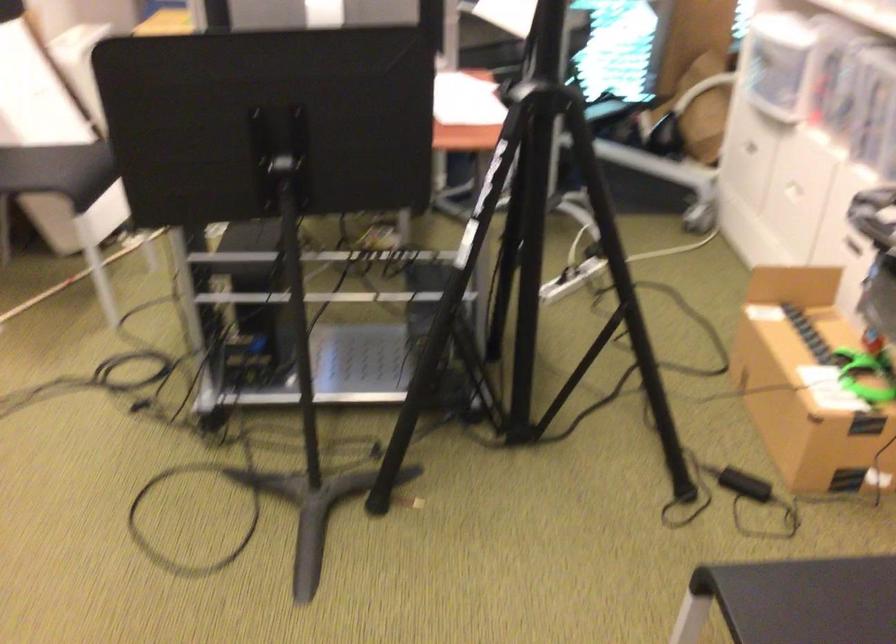
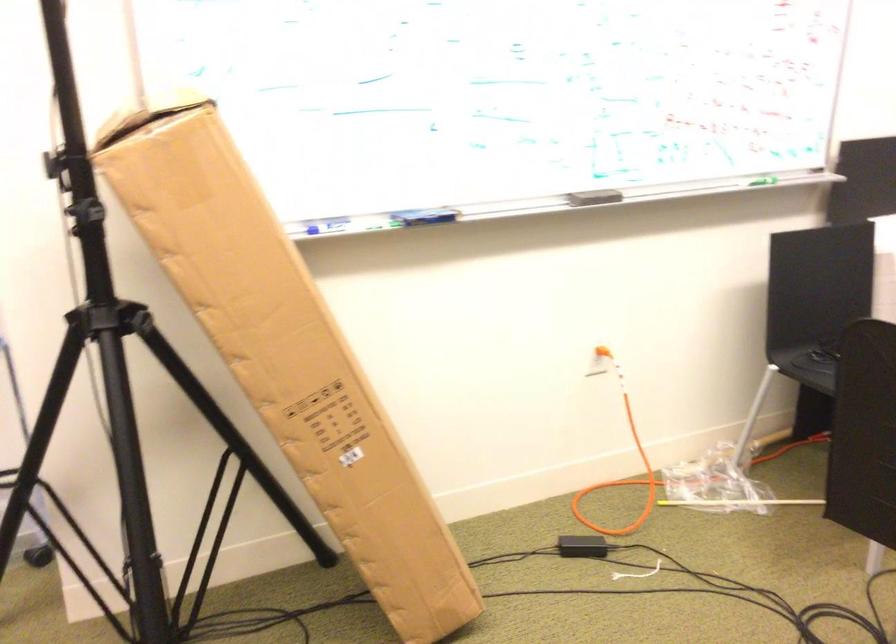
Question: The camera is either moving clockwise (left) or counter-clockwise (right) around the object. The first image is from the beginning of the video and the second image is from the end. Is the camera moving left or right when shooting the video?

Choices:
 (A) Left
 (B) Right

Answer: (B)